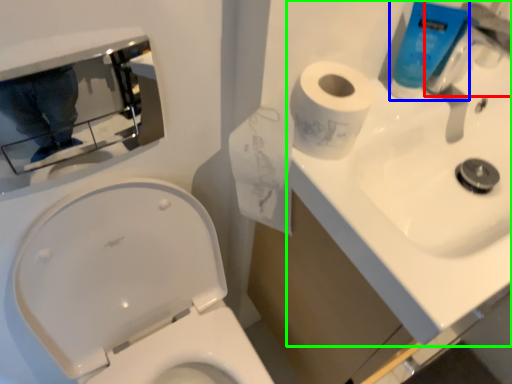
Question: Considering the real-world distances, which object is farthest from faucet (highlighted by a red box)? cleaning product (highlighted by a blue box) or sink (highlighted by a green box)?

Choices:
 (A) cleaning product
 (B) sink

Answer: (B)